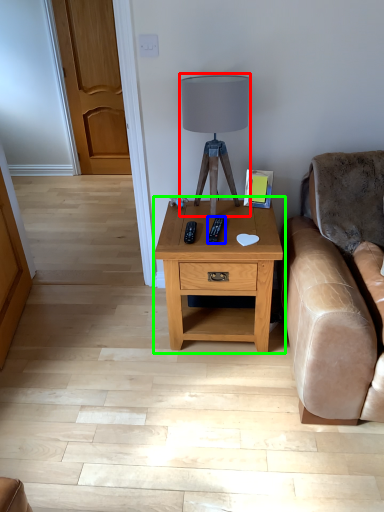
Question: Which object is the farthest from table lamp (highlighted by a red box)? Choose among these: remote (highlighted by a blue box) or nightstand (highlighted by a green box).

Choices:
 (A) remote
 (B) nightstand

Answer: (B)